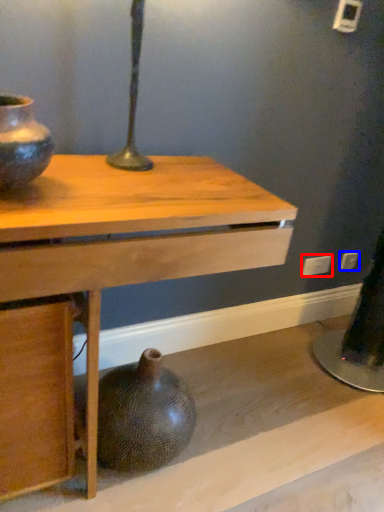
Question: Among these objects, which one is farthest to the camera, electric outlet (highlighted by a red box) or electric outlet (highlighted by a blue box)?

Choices:
 (A) electric outlet
 (B) electric outlet

Answer: (B)